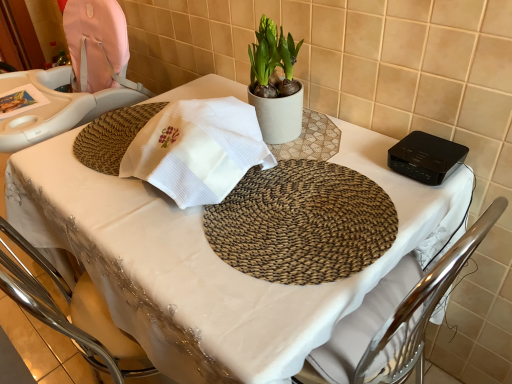
What are the coordinates of `vacant location behind black plastic device at upper right` in the screenshot? It's located at (364, 135).